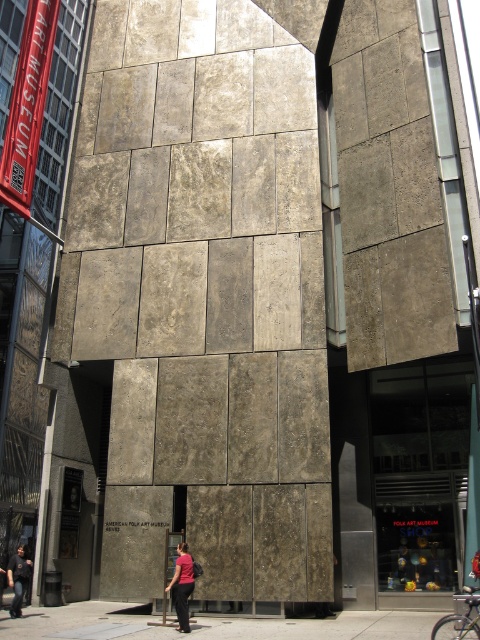
You are standing in front of the American Folk Art Museum and see a matte pink shirt at center and a dark gray concrete person at lower left. Which object is located to the right of the other?

The matte pink shirt at center is positioned on the right side of dark gray concrete person at lower left.

You are an art student standing in front of the American Folk Art Museum. You notice a matte pink shirt at center and a dark gray concrete person at lower left. Which object is covering part of the other?

The matte pink shirt at center is positioned over the dark gray concrete person at lower left, so it is covering part of the dark gray concrete person at lower left.